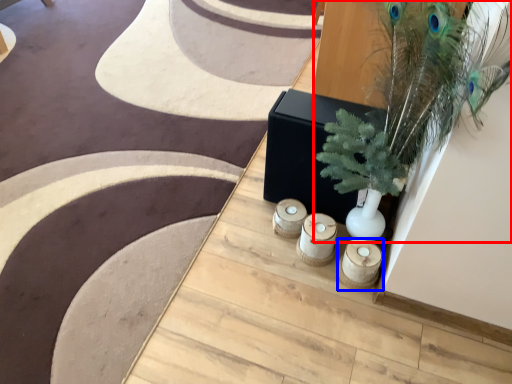
Question: Which point is further to the camera, houseplant (highlighted by a red box) or candle holder (highlighted by a blue box)?

Choices:
 (A) houseplant
 (B) candle holder

Answer: (B)